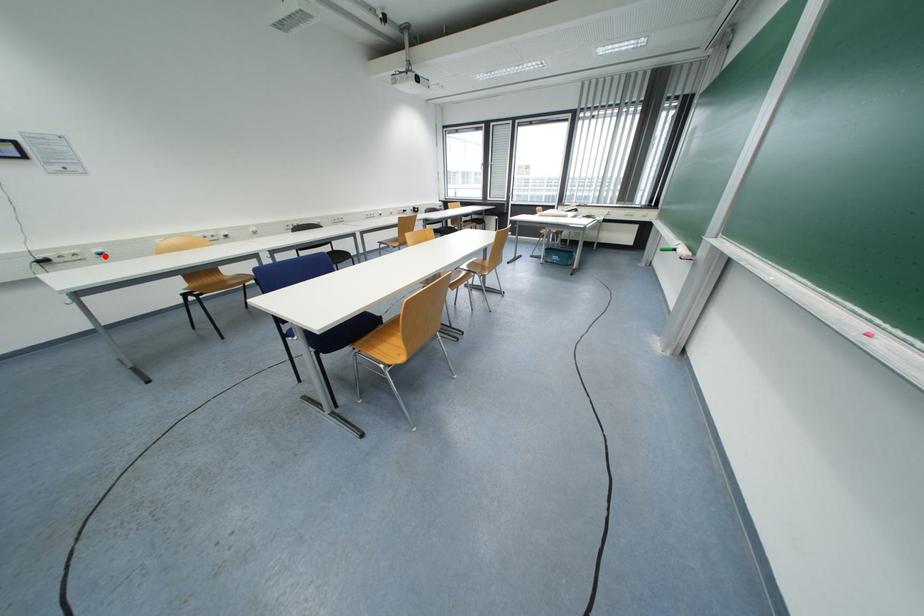
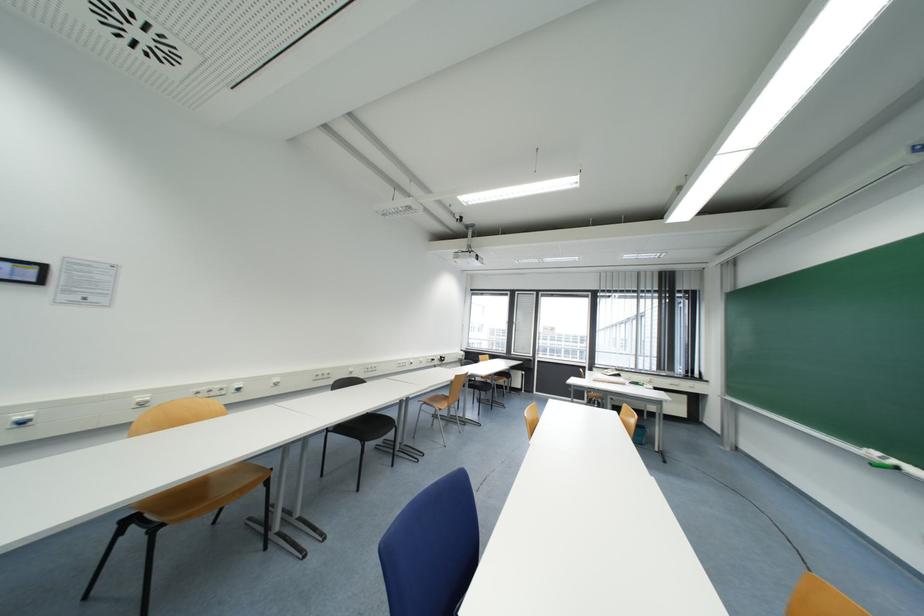
Question: I am providing you with two images of the same scene from different viewpoints. In image1, a red point is highlighted. Considering the same 3D point in image2, which of the following is correct?

Choices:
 (A) It is closer
 (B) It is farther

Answer: (A)